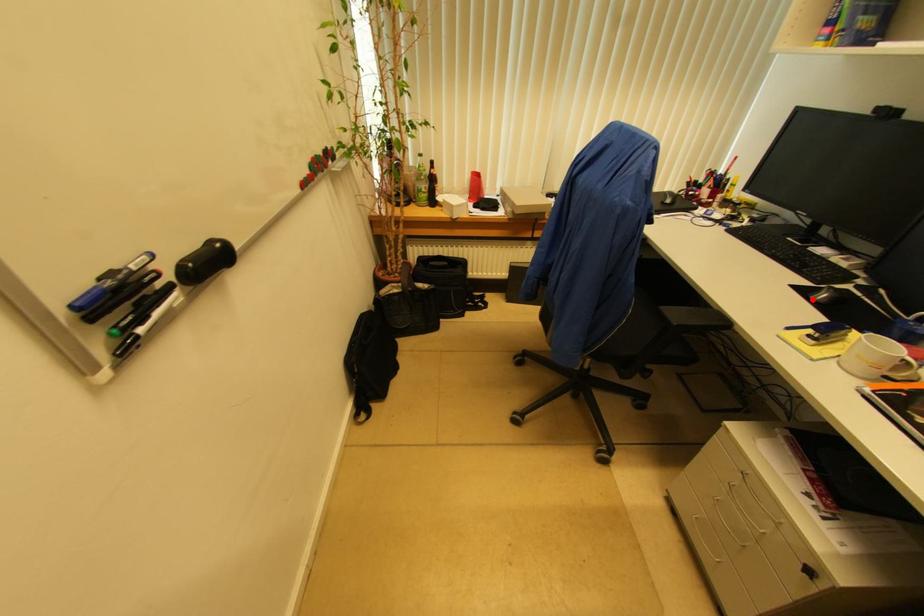
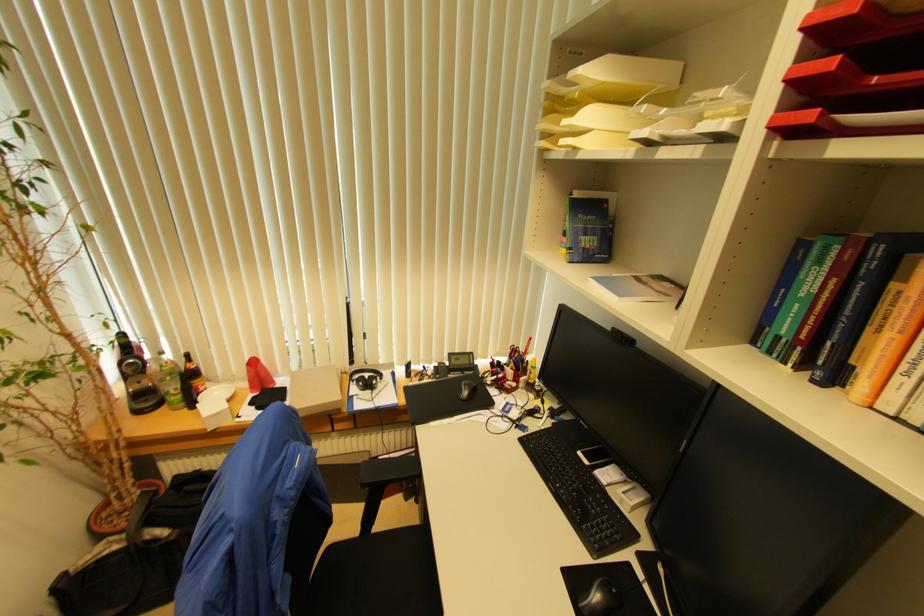
In the second image, find the point that corresponds to the highlighted location in the first image.

(580, 608)